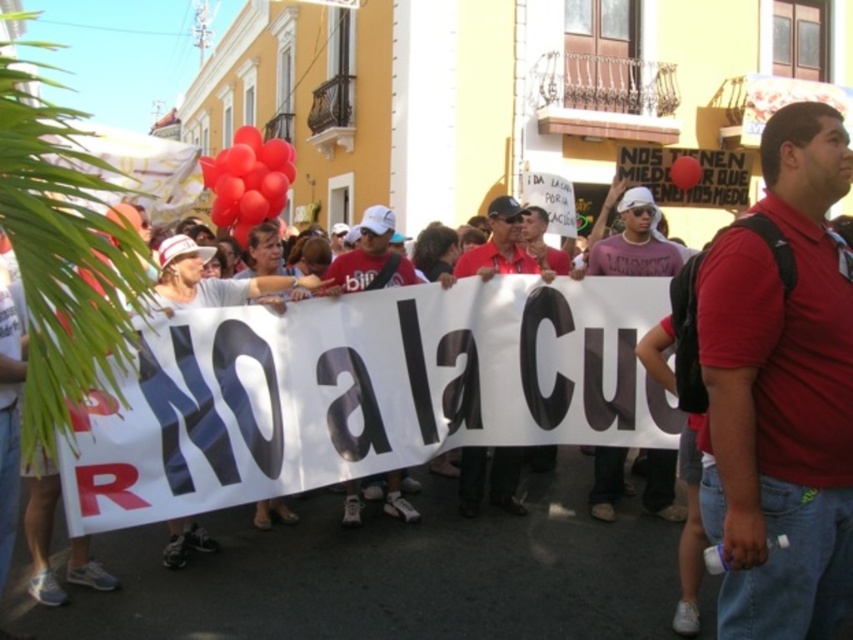
You are a photographer standing at the edge of the protest crowd. You want to take a photo that includes both the matte red shirt at center and the rubber balloon at center. Which object should you focus on first to ensure both are in sharp focus?

The matte red shirt at center is closer to the viewer than the rubber balloon at center. To ensure both are in sharp focus, you should focus on the matte red shirt at center first, as it is the closer object. This will create a depth of field that includes the rubber balloon at center in the background.

You are a photographer at the protest scene described. You need to capture the white matte cap at center in your shot. Based on its position, where should you aim your camera?

You should aim your camera at point 0.380 on the x axis and 0.746 on the y axis to capture the white matte cap at center.

You are a photographer trying to capture the protest scene. You notice the matte red shirt at center and the rubber balloon at center. From your perspective, which object is positioned to the left?

The matte red shirt at center is to the left of the rubber balloon at center.